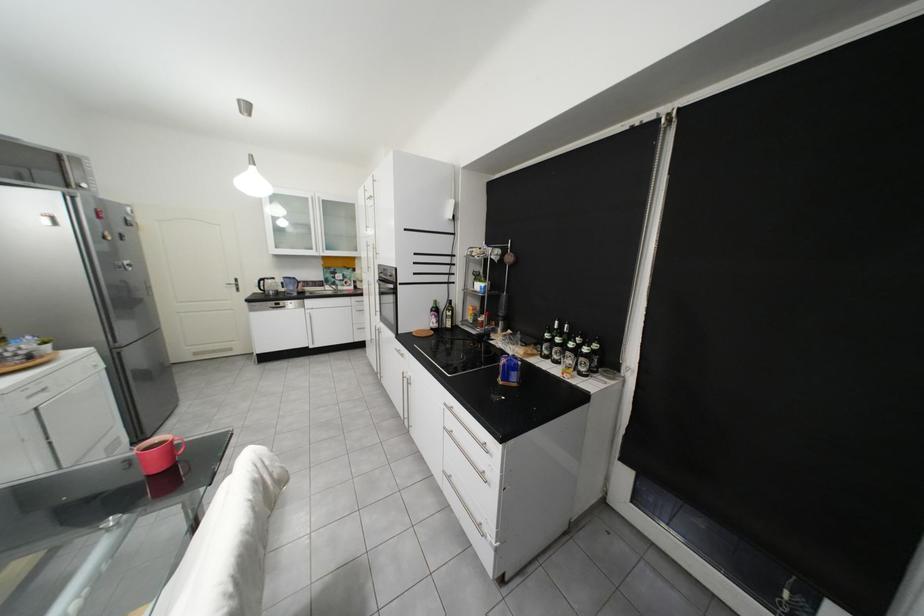
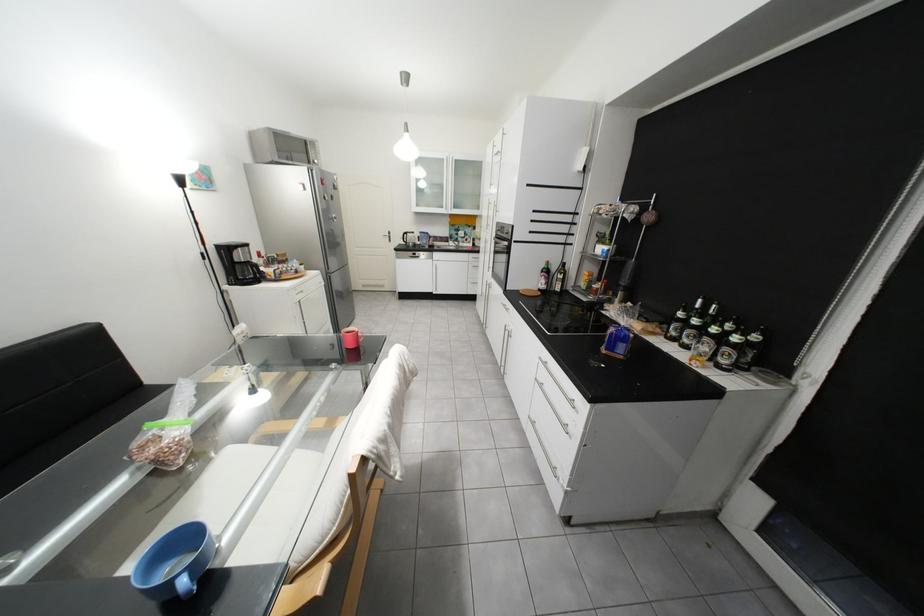
In the second image, find the point that corresponds to point (101, 351) in the first image.

(330, 273)